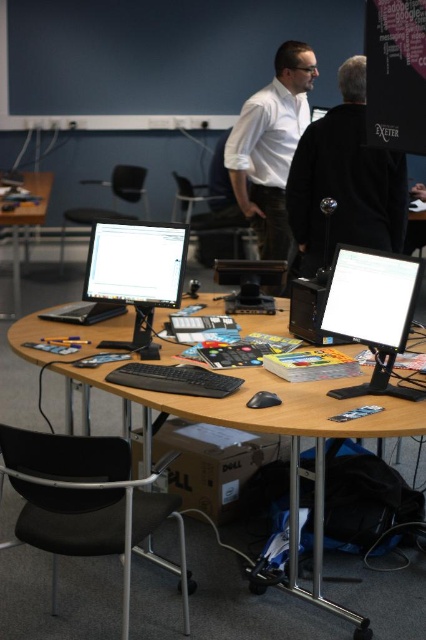
Does black plastic chair at lower left have a smaller size compared to black matte jacket at upper center?

Correct, black plastic chair at lower left occupies less space than black matte jacket at upper center.

Can you confirm if black plastic chair at lower left is bigger than black matte jacket at upper center?

No, black plastic chair at lower left is not bigger than black matte jacket at upper center.

The height and width of the screenshot is (640, 426). Find the location of `black plastic chair at lower left`. black plastic chair at lower left is located at coordinates (85, 502).

Identify the location of black plastic chair at lower left. (85, 502).

Who is more distant from viewer, (373, 225) or (115, 193)?

Point (115, 193)

Can you confirm if black matte jacket at upper center is positioned below black plastic chair at center?

Indeed, black matte jacket at upper center is positioned under black plastic chair at center.

Between point (342, 67) and point (92, 212), which one is positioned in front?

Point (342, 67)

At what (x,y) coordinates should I click in order to perform the action: click on black matte jacket at upper center. Please return your answer as a coordinate pair (x, y). This screenshot has height=640, width=426. Looking at the image, I should click on tap(345, 180).

Between black plastic chair at lower left and white matte shirt at upper center, which one appears on the left side from the viewer's perspective?

black plastic chair at lower left is more to the left.

The height and width of the screenshot is (640, 426). What are the coordinates of `black plastic chair at lower left` in the screenshot? It's located at (85, 502).

Is point (63, 460) more distant than point (305, 116)?

No.

Image resolution: width=426 pixels, height=640 pixels. What are the coordinates of `black plastic chair at lower left` in the screenshot? It's located at [85, 502].